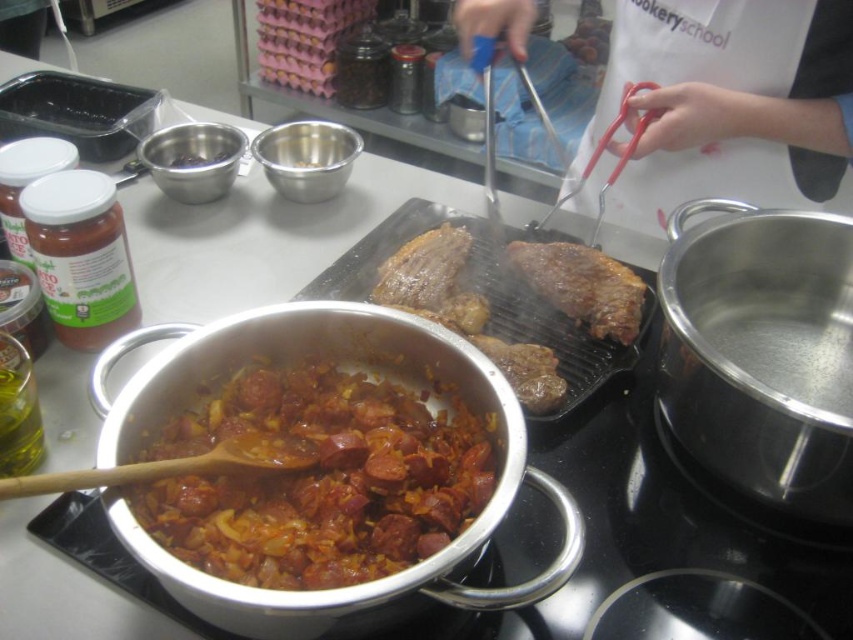
You are a chef preparing a dish and need to reach for either the blue plastic tongs at center or the metallic bowl at upper left. Which item will you grab first if you want to pick up the closest one to you?

The blue plastic tongs at center is closer to the viewer than the metallic bowl at upper left, so you should grab the blue plastic tongs at center first.

You are a chef holding a 30 inch long spatula. You need to reach the blue plastic tongs at center from where you are standing. Can you reach it with your spatula?

The blue plastic tongs at center is 29.39 inches from viewer. Since your spatula is 30 inches long, you can just barely reach it.

You are a chef preparing a dish and need to check the readiness of both the brown glossy sausages at center and the brown charred steak at center. Which one is closer to you when standing in front of the stove?

The brown glossy sausages at center are closer because they are in front of the brown charred steak at center.